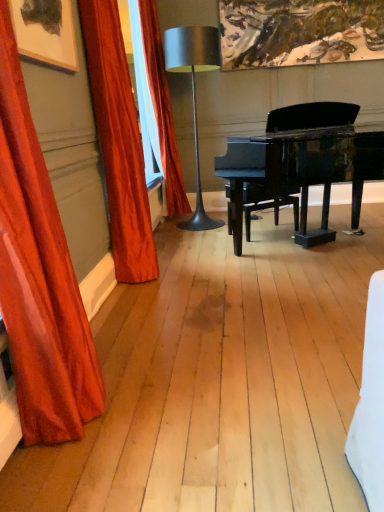
Question: Could black polished piano at center be considered to be inside metallic silver table lamp at center?

Choices:
 (A) no
 (B) yes

Answer: (A)

Question: Is metallic silver table lamp at center at the left side of black polished piano at center?

Choices:
 (A) yes
 (B) no

Answer: (A)

Question: Can you confirm if metallic silver table lamp at center is bigger than black polished piano at center?

Choices:
 (A) yes
 (B) no

Answer: (B)

Question: From a real-world perspective, is metallic silver table lamp at center over black polished piano at center?

Choices:
 (A) yes
 (B) no

Answer: (A)

Question: Does metallic silver table lamp at center have a lesser width compared to black polished piano at center?

Choices:
 (A) no
 (B) yes

Answer: (B)

Question: From the image's perspective, is metallic silver table lamp at center under black polished piano at center?

Choices:
 (A) yes
 (B) no

Answer: (B)

Question: Does satin red curtain at left, acting as the 1th curtain starting from the front, have a lesser width compared to metallic silver table lamp at center?

Choices:
 (A) no
 (B) yes

Answer: (B)

Question: Considering the relative sizes of satin red curtain at left, the third curtain from the back, and metallic silver table lamp at center in the image provided, is satin red curtain at left, the third curtain from the back, bigger than metallic silver table lamp at center?

Choices:
 (A) no
 (B) yes

Answer: (A)

Question: Is satin red curtain at left, acting as the 1th curtain starting from the front, closer to camera compared to metallic silver table lamp at center?

Choices:
 (A) yes
 (B) no

Answer: (A)

Question: From the image's perspective, is satin red curtain at left, the third curtain from the back, over metallic silver table lamp at center?

Choices:
 (A) no
 (B) yes

Answer: (A)

Question: From the image's perspective, is satin red curtain at left, the third curtain from the back, below metallic silver table lamp at center?

Choices:
 (A) yes
 (B) no

Answer: (A)

Question: Considering the relative sizes of satin red curtain at left, the third curtain from the back, and metallic silver table lamp at center in the image provided, is satin red curtain at left, the third curtain from the back, smaller than metallic silver table lamp at center?

Choices:
 (A) no
 (B) yes

Answer: (B)

Question: Is black polished piano at center positioned far away from satin red curtain at left, acting as the 2th curtain starting from the front?

Choices:
 (A) yes
 (B) no

Answer: (A)